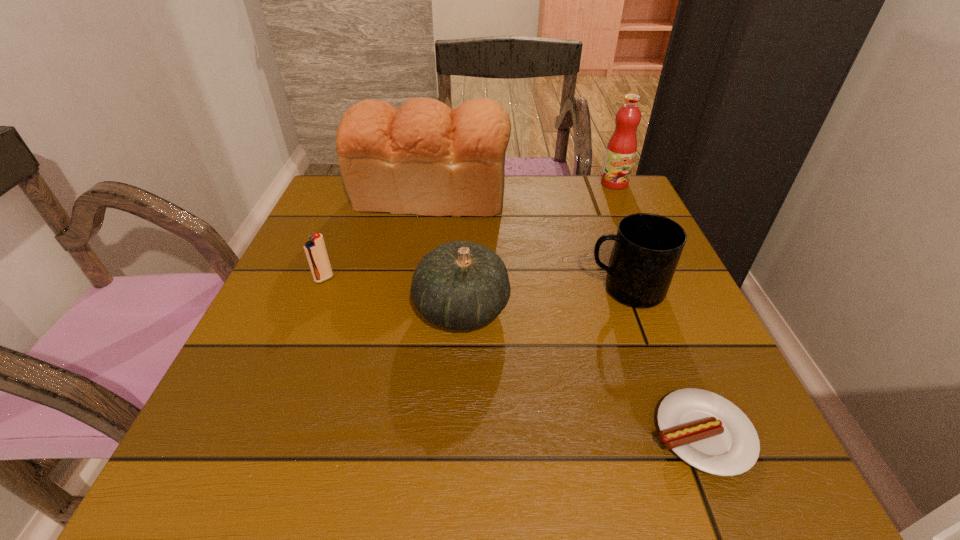
Where is `vacant region between the second shortest object and the bread`? vacant region between the second shortest object and the bread is located at coordinates 377,238.

This screenshot has height=540, width=960. What are the coordinates of `free point between the gourd and the fifth tallest object` in the screenshot? It's located at (393, 294).

Locate which object ranks third in proximity to the bread. Please provide its 2D coordinates. Your answer should be formatted as a tuple, i.e. [(x, y)], where the tuple contains the x and y coordinates of a point satisfying the conditions above.

[(647, 248)]

This screenshot has width=960, height=540. What are the coordinates of `object that can be found as the second closest to the gourd` in the screenshot? It's located at (315, 249).

In order to click on blank area in the image that satisfies the following two spatial constraints: 1. on the side of the shortest object with the handle; 2. on the left side of the mug in this screenshot , I will do `click(678, 434)`.

The image size is (960, 540). What are the coordinates of `vacant space that satisfies the following two spatial constraints: 1. on the front side of the bread; 2. on the right side of the gourd` in the screenshot? It's located at (413, 308).

Locate an element on the screen. This screenshot has height=540, width=960. free region that satisfies the following two spatial constraints: 1. on the back side of the shortest object; 2. on the side of the mug with the handle is located at coordinates (642, 289).

I want to click on vacant region that satisfies the following two spatial constraints: 1. on the side of the mug with the handle; 2. on the right side of the sausage, so click(x=678, y=434).